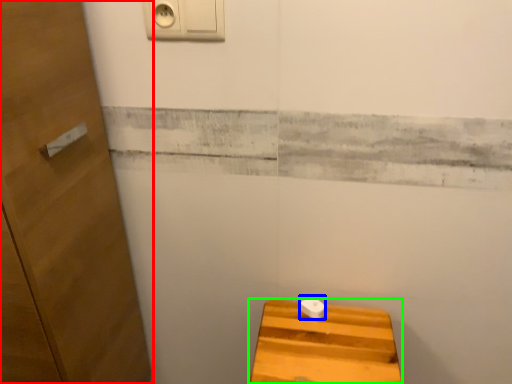
Question: Which is nearer to the door (highlighted by a red box)? knob (highlighted by a blue box) or furniture (highlighted by a green box).

Choices:
 (A) knob
 (B) furniture

Answer: (B)